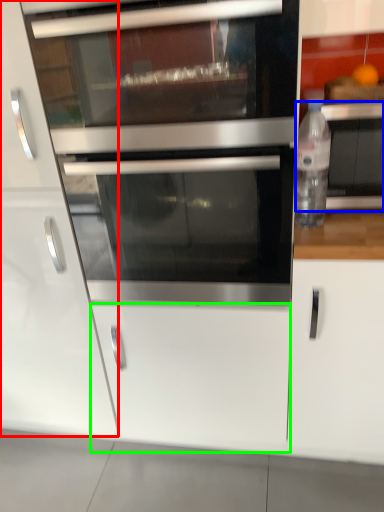
Question: Which is farther away from cabinetry (highlighted by a red box)? appliance (highlighted by a blue box) or drawer (highlighted by a green box)?

Choices:
 (A) appliance
 (B) drawer

Answer: (A)